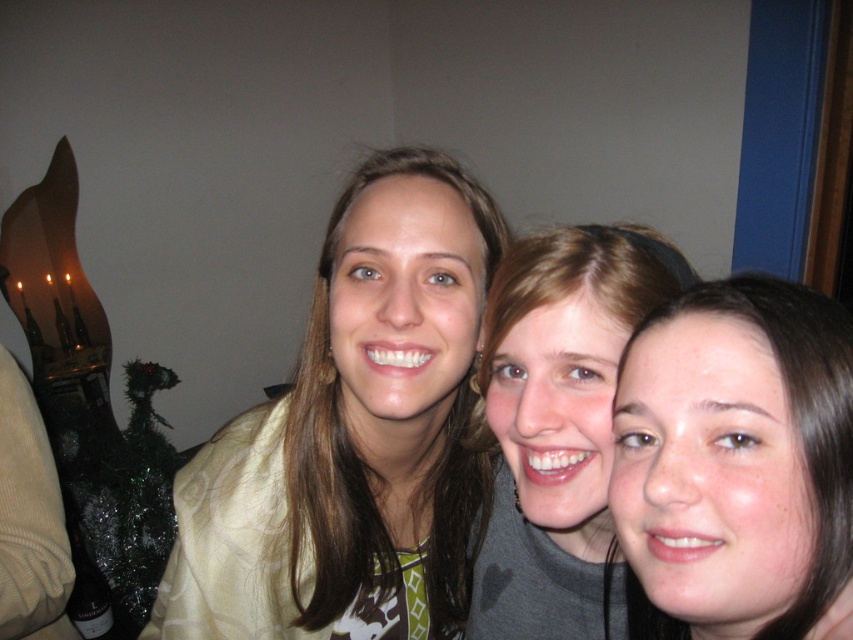
Question: Estimate the real-world distances between objects in this image. Which object is farther from the dark brown hair at center?

Choices:
 (A) light beige sweater at center
 (B) gray matte shirt at center

Answer: (A)

Question: Considering the relative positions of dark brown hair at center and gray matte shirt at center in the image provided, where is dark brown hair at center located with respect to gray matte shirt at center?

Choices:
 (A) left
 (B) right

Answer: (B)

Question: Is light beige sweater at center wider than gray matte shirt at center?

Choices:
 (A) yes
 (B) no

Answer: (A)

Question: Which of the following is the closest to the observer?

Choices:
 (A) gray matte shirt at center
 (B) dark brown hair at center

Answer: (B)

Question: Can you confirm if light beige sweater at center is bigger than dark brown hair at center?

Choices:
 (A) no
 (B) yes

Answer: (B)

Question: Which point is closer to the camera taking this photo?

Choices:
 (A) (483, 547)
 (B) (666, 502)

Answer: (B)